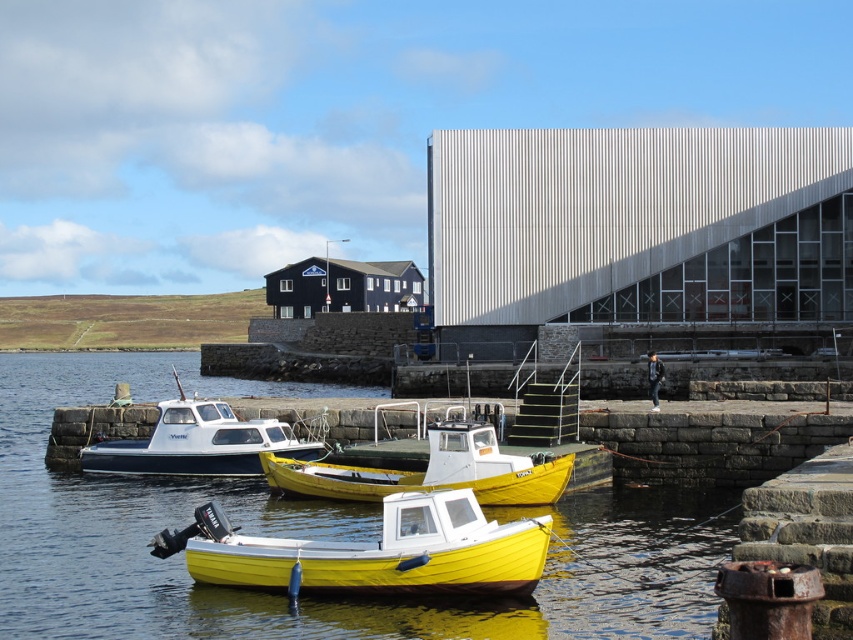
Question: Does yellow matte water at center appear on the left side of yellow matte boat at lower center?

Choices:
 (A) no
 (B) yes

Answer: (B)

Question: Which point is closer to the camera taking this photo?

Choices:
 (A) (374, 588)
 (B) (57, 515)
 (C) (453, 486)
 (D) (132, 465)

Answer: (A)

Question: Is yellow matte boat at lower center wider than yellow matte boat at center?

Choices:
 (A) yes
 (B) no

Answer: (A)

Question: In this image, where is yellow matte boat at lower center located relative to white plastic boat at center?

Choices:
 (A) below
 (B) above

Answer: (A)

Question: Which object is farther from the camera taking this photo?

Choices:
 (A) yellow matte boat at center
 (B) white plastic boat at center

Answer: (B)

Question: Which point is closer to the camera?

Choices:
 (A) (263, 442)
 (B) (494, 561)
 (C) (491, 497)
 (D) (387, 611)

Answer: (D)